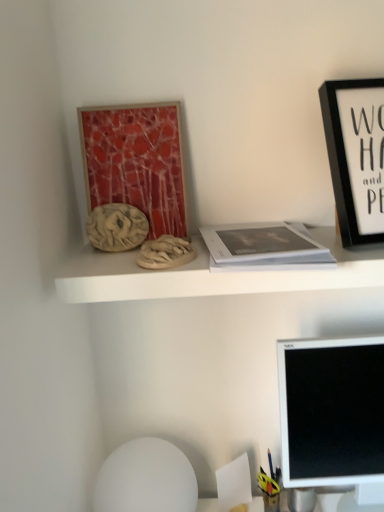
Where is `vacant space in front of matte clay sculpture at upper left`? Image resolution: width=384 pixels, height=512 pixels. vacant space in front of matte clay sculpture at upper left is located at coordinates (109, 263).